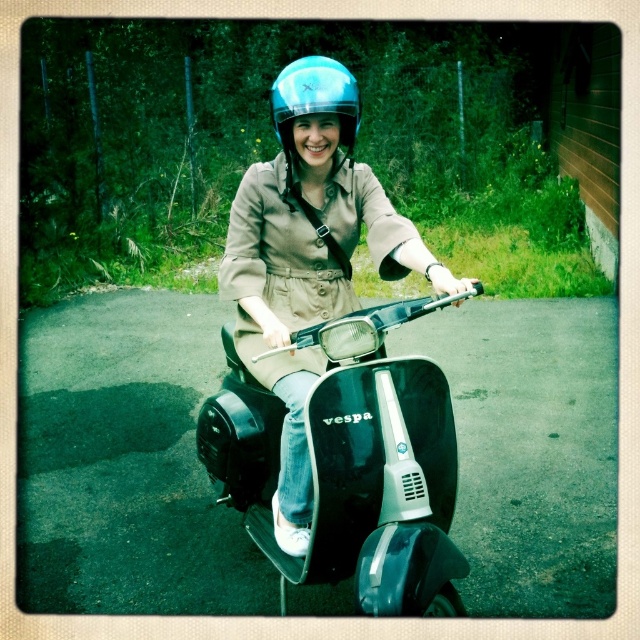
You are standing at a distance and want to take a photo of the black glossy vespa at center. If your camera can focus on objects up to 6 feet away, will it be able to capture the vespa clearly?

The black glossy vespa at center is 5.85 feet away from the camera, which is within the camera focus range of up to 6 feet. Therefore, the camera can capture the vespa clearly.

You are a photographer positioned to capture the scene of the person riding the black glossy vespa at center and wearing the blue glossy helmet at center. Which object is positioned closer to your camera lens?

The black glossy vespa at center is closer to the viewer than the blue glossy helmet at center, so the Vespa would be closer to the camera lens.

Consider the image. You are a photographer trying to capture the black glossy vespa at center and the blue glossy helmet at center in a single shot. Based on their positions, which object should you focus on first to ensure both are in frame?

The black glossy vespa at center is positioned under the blue glossy helmet at center, so you should focus on the blue glossy helmet at center first to ensure both are in frame.